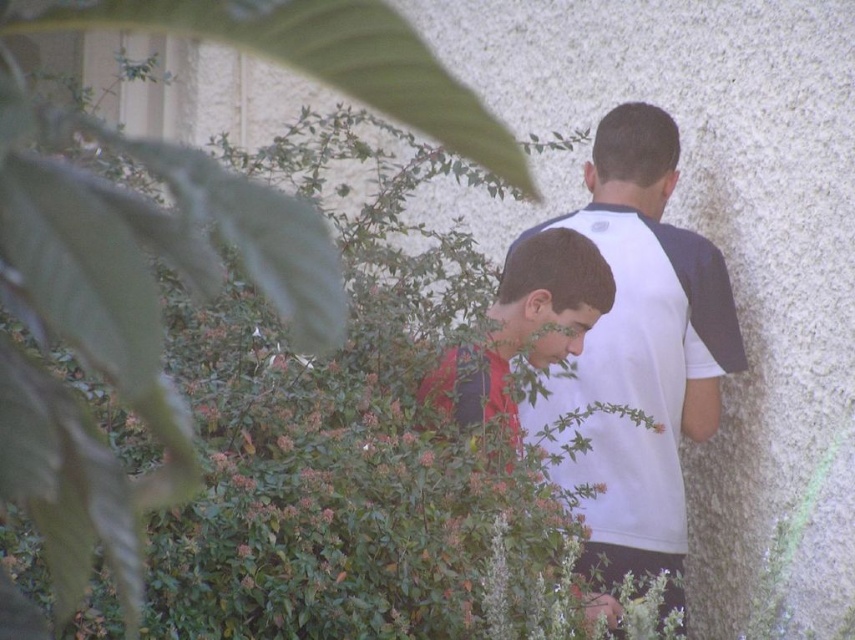
Does point (295, 38) come in front of point (598, 316)?

Yes, it is in front of point (598, 316).

Image resolution: width=855 pixels, height=640 pixels. What are the coordinates of `green leafy bush at center` in the screenshot? It's located at (174, 252).

Find the location of `green leafy bush at center`. green leafy bush at center is located at coordinates tap(174, 252).

Describe the element at coordinates (174, 252) in the screenshot. This screenshot has height=640, width=855. I see `green leafy bush at center` at that location.

Is green leafy bush at center positioned at the back of white fabric shirt at center?

That is False.

Is point (310, 52) positioned after point (593, 518)?

No.

At what (x,y) coordinates should I click in order to perform the action: click on green leafy bush at center. Please return your answer as a coordinate pair (x, y). The image size is (855, 640). Looking at the image, I should click on (174, 252).

How distant is white fabric shirt at center from matte red shirt at center?

white fabric shirt at center is 14.30 inches away from matte red shirt at center.

Who is higher up, white fabric shirt at center or matte red shirt at center?

Positioned higher is matte red shirt at center.

Who is more distant from viewer, (567, 406) or (445, 365)?

The point (567, 406) is more distant.

Locate an element on the screen. This screenshot has height=640, width=855. white fabric shirt at center is located at coordinates (641, 348).